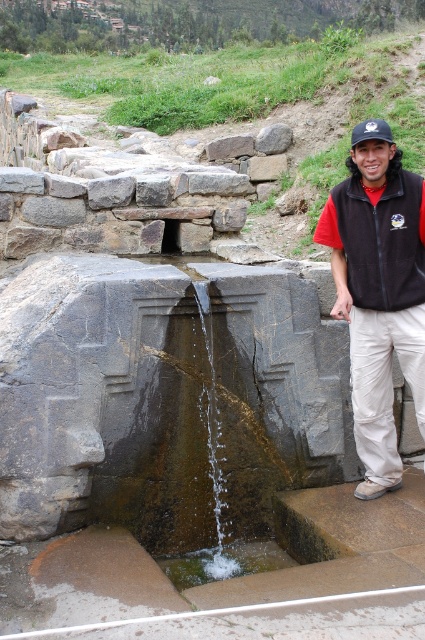
Can you confirm if black fleece vest at center is positioned to the right of gray rough stone at center?

Indeed, black fleece vest at center is positioned on the right side of gray rough stone at center.

Is point (405, 262) less distant than point (209, 156)?

That is True.

I want to click on black fleece vest at center, so click(379, 296).

Can you confirm if black fleece vest at center is positioned below black fleece vest at right?

Indeed, black fleece vest at center is positioned under black fleece vest at right.

Which is more to the right, black fleece vest at center or black fleece vest at right?

black fleece vest at center

The height and width of the screenshot is (640, 425). In order to click on black fleece vest at center in this screenshot , I will do click(x=379, y=296).

Identify the location of black fleece vest at center. This screenshot has width=425, height=640. (379, 296).

Is point (371, 332) closer to camera compared to point (283, 134)?

Yes.

Is black fleece vest at center wider than gray rough rock at center?

Indeed, black fleece vest at center has a greater width compared to gray rough rock at center.

Between point (393, 173) and point (263, 150), which one is positioned behind?

The point (263, 150) is behind.

Identify the location of black fleece vest at center. This screenshot has height=640, width=425. (x=379, y=296).